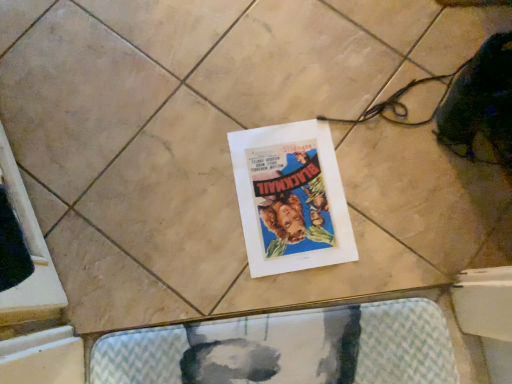
Locate an element on the screen. The height and width of the screenshot is (384, 512). free space in front of matte paper comic book at center is located at coordinates (278, 292).